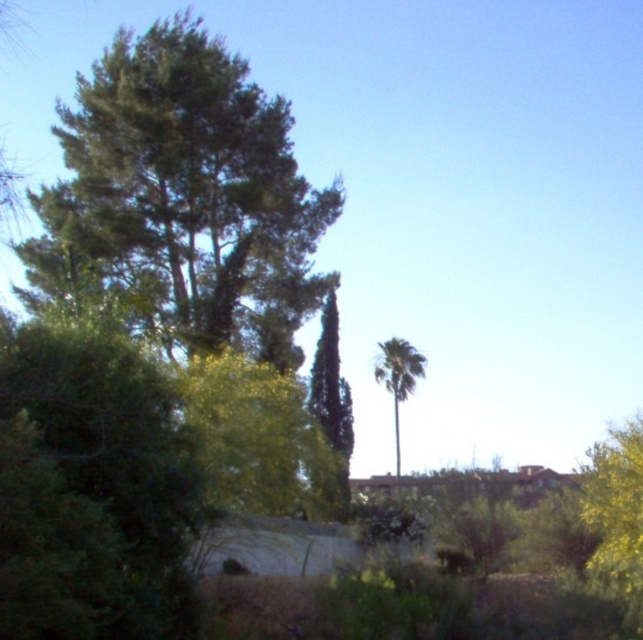
Question: Which object is farther from the camera taking this photo?

Choices:
 (A) green leafy bush at right
 (B) green leafy tree at upper left

Answer: (B)

Question: Observing the image, what is the correct spatial positioning of green leafy tree at upper left in reference to green leafy bush at right?

Choices:
 (A) below
 (B) above

Answer: (B)

Question: Based on their relative distances, which object is farther from the green leafy palm at center?

Choices:
 (A) green leafy bush at right
 (B) green leafy tree at upper left

Answer: (A)

Question: Can you confirm if green leafy tree at upper left is positioned above green leafy palm at center?

Choices:
 (A) no
 (B) yes

Answer: (B)

Question: Can you confirm if green leafy bush at right is smaller than green leafy palm at center?

Choices:
 (A) yes
 (B) no

Answer: (A)

Question: Among these points, which one is farthest from the camera?

Choices:
 (A) (590, 480)
 (B) (390, 371)

Answer: (B)